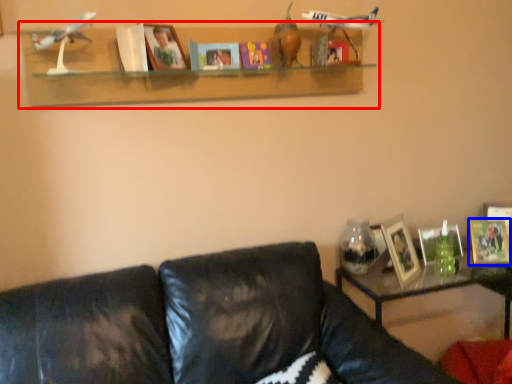
Question: Which object appears farthest to the camera in this image, shelf (highlighted by a red box) or picture frame (highlighted by a blue box)?

Choices:
 (A) shelf
 (B) picture frame

Answer: (B)